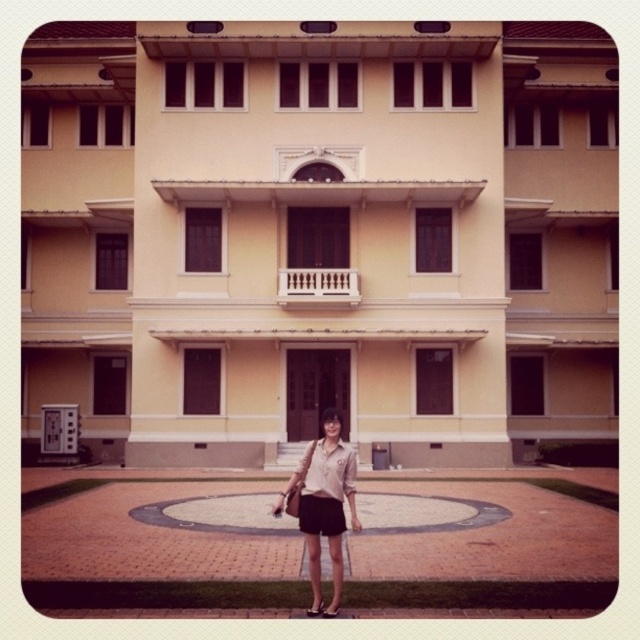
Who is shorter, matte beige blouse at center or light beige fabric dress at center?

With less height is light beige fabric dress at center.

Can you confirm if matte beige blouse at center is smaller than light beige fabric dress at center?

Incorrect, matte beige blouse at center is not smaller in size than light beige fabric dress at center.

Does point (330, 536) come in front of point (307, 483)?

Yes, it is.

I want to click on matte beige blouse at center, so click(x=324, y=506).